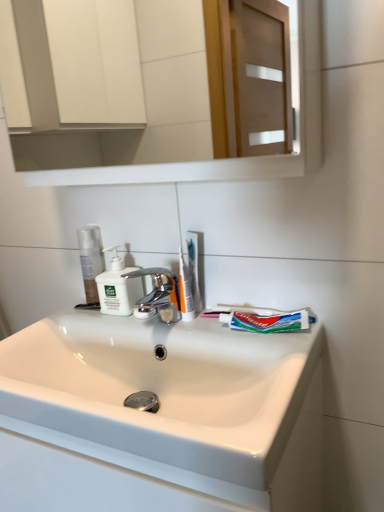
Find the location of `unoccupied region to the right of chrome metallic faucet at center`. unoccupied region to the right of chrome metallic faucet at center is located at coordinates [231, 336].